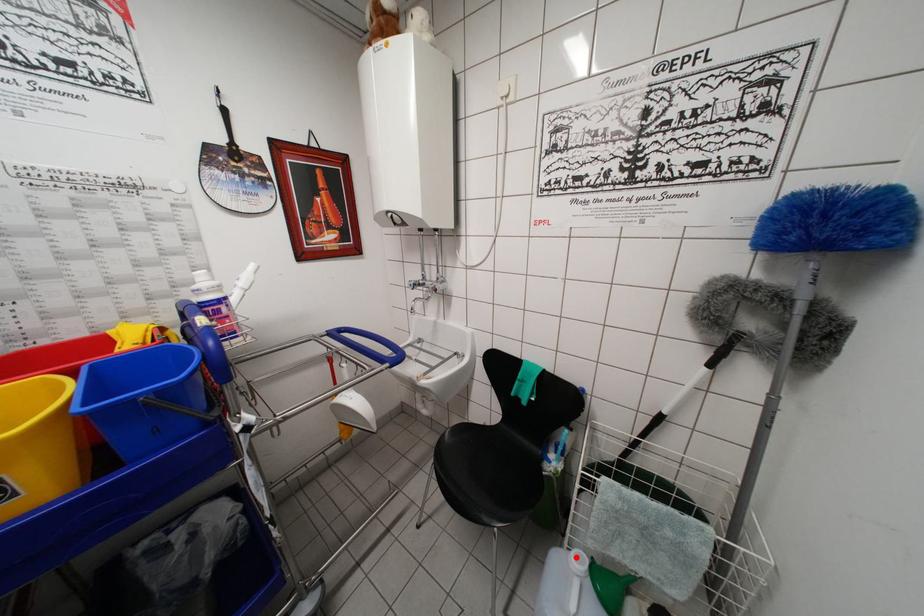
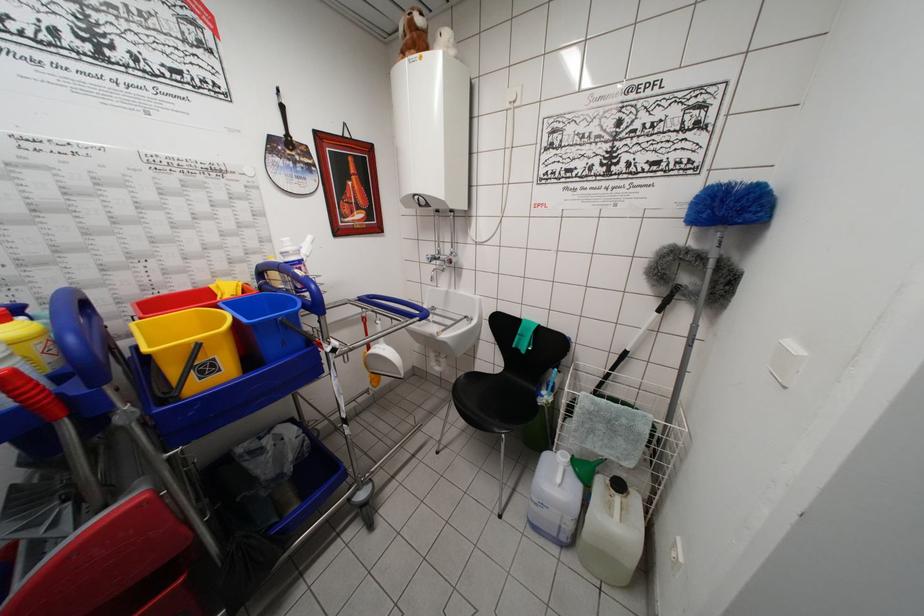
The point at the highlighted location is marked in the first image. Where is the corresponding point in the second image?

(563, 456)